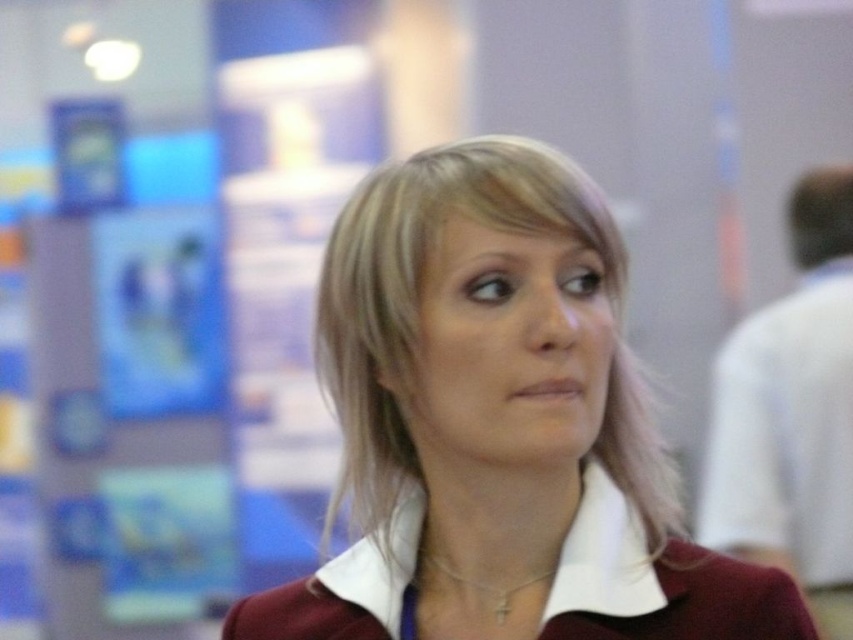
Based on the scene description, where is the white cotton dress shirt at right located in terms of its 2D coordinates?

The white cotton dress shirt at right is located at the 2D coordinates of point [791,413].

Based on the scene description, can you determine if the white cotton dress shirt at right is wider than the gold chain necklace at center?

The white cotton dress shirt at right might be wider than gold chain necklace at center according to the description.